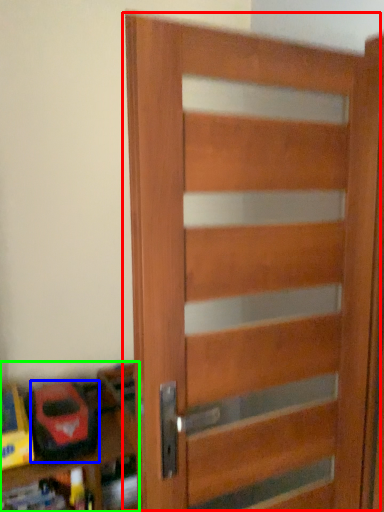
Question: Which is nearer to the door (highlighted by a red box)? toy (highlighted by a blue box) or shelf (highlighted by a green box).

Choices:
 (A) toy
 (B) shelf

Answer: (B)